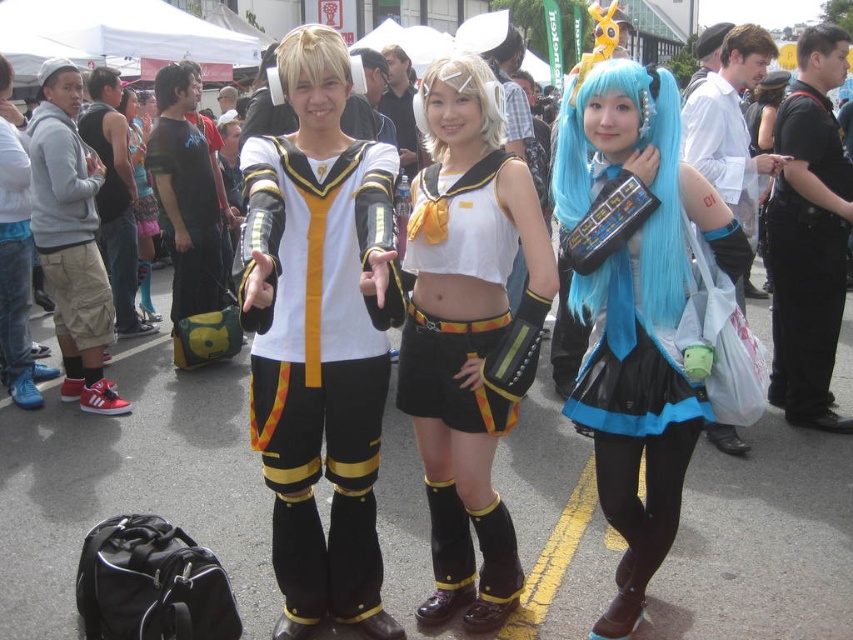
Who is positioned more to the left, black leather jacket at upper right or matte black skirt at center?

matte black skirt at center is more to the left.

Who is more forward, (x=782, y=400) or (x=136, y=138)?

Positioned in front is point (x=782, y=400).

Identify the location of black leather jacket at upper right. This screenshot has height=640, width=853. (804, 296).

Is blue satin dress at center wider than black fabric bag at center?

No.

Does blue satin dress at center have a larger size compared to black fabric bag at center?

No.

Which is in front, point (672, 184) or point (178, 268)?

Point (672, 184) is in front.

This screenshot has height=640, width=853. I want to click on blue satin dress at center, so click(x=637, y=330).

Between white matte sailor top at center and matte black skirt at center, which one appears on the right side from the viewer's perspective?

From the viewer's perspective, white matte sailor top at center appears more on the right side.

Who is taller, white matte sailor top at center or matte black skirt at center?

Standing taller between the two is matte black skirt at center.

Is point (474, 429) in front of point (137, 180)?

Yes, point (474, 429) is in front of point (137, 180).

The image size is (853, 640). Identify the location of white matte sailor top at center. (456, 371).